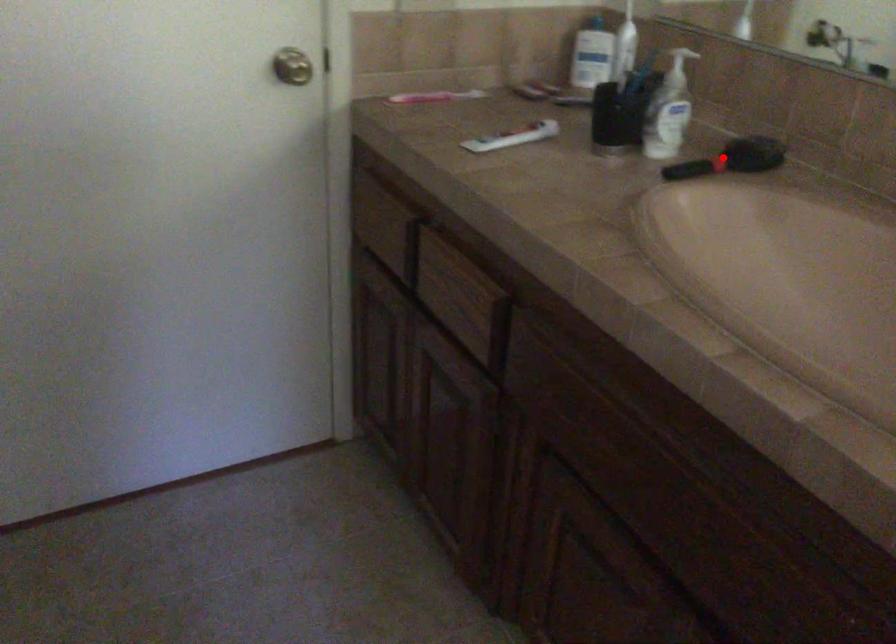
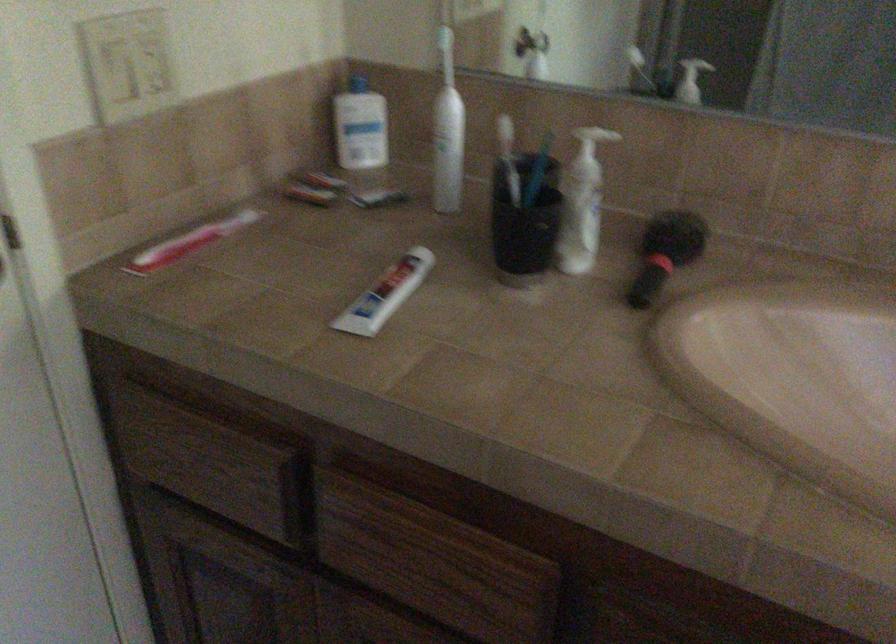
Find the pixel in the second image that matches the highlighted location in the first image.

(666, 252)